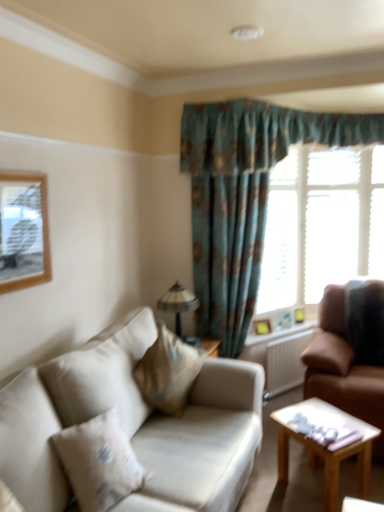
Question: Is wooden picture frame at right, the 2th picture frame from the left, positioned far away from matte glass lampshade at center?

Choices:
 (A) yes
 (B) no

Answer: (B)

Question: From a real-world perspective, is wooden picture frame at right, arranged as the second picture frame when viewed from the front, located higher than matte glass lampshade at center?

Choices:
 (A) yes
 (B) no

Answer: (B)

Question: Is matte glass lampshade at center completely or partially inside wooden picture frame at right, the 1th picture frame when ordered from bottom to top?

Choices:
 (A) yes
 (B) no

Answer: (B)

Question: Does wooden picture frame at right, arranged as the first picture frame when viewed from the right, appear on the left side of matte glass lampshade at center?

Choices:
 (A) yes
 (B) no

Answer: (B)

Question: Does wooden picture frame at right, the 2th picture frame from the left, lie in front of matte glass lampshade at center?

Choices:
 (A) yes
 (B) no

Answer: (B)

Question: Is point (19, 478) positioned closer to the camera than point (266, 325)?

Choices:
 (A) farther
 (B) closer

Answer: (B)

Question: In terms of width, does beige fabric pillow at lower left, which is counted as the 2th pillow, starting from the right, look wider or thinner when compared to wooden picture frame at right, the 1th picture frame when ordered from back to front?

Choices:
 (A) wide
 (B) thin

Answer: (A)

Question: In the image, is beige fabric pillow at lower left, which is counted as the first pillow, starting from the front, on the left side or the right side of wooden picture frame at right, the 1th picture frame when ordered from back to front?

Choices:
 (A) left
 (B) right

Answer: (A)

Question: Is beige fabric pillow at lower left, which is counted as the second pillow, starting from the back, in front of or behind wooden picture frame at right, the 1th picture frame when ordered from back to front, in the image?

Choices:
 (A) behind
 (B) front

Answer: (B)

Question: Is light brown wooden coffee table at lower right taller or shorter than white wooden blinds at upper right?

Choices:
 (A) tall
 (B) short

Answer: (B)

Question: From a real-world perspective, is light brown wooden coffee table at lower right positioned above or below white wooden blinds at upper right?

Choices:
 (A) above
 (B) below

Answer: (B)

Question: In terms of width, does light brown wooden coffee table at lower right look wider or thinner when compared to white wooden blinds at upper right?

Choices:
 (A) wide
 (B) thin

Answer: (A)

Question: Relative to white wooden blinds at upper right, is light brown wooden coffee table at lower right in front or behind?

Choices:
 (A) front
 (B) behind

Answer: (A)

Question: Considering the positions of matte glass lampshade at center and light brown wooden coffee table at lower right in the image, is matte glass lampshade at center wider or thinner than light brown wooden coffee table at lower right?

Choices:
 (A) wide
 (B) thin

Answer: (B)

Question: From a real-world perspective, relative to light brown wooden coffee table at lower right, is matte glass lampshade at center vertically above or below?

Choices:
 (A) below
 (B) above

Answer: (B)